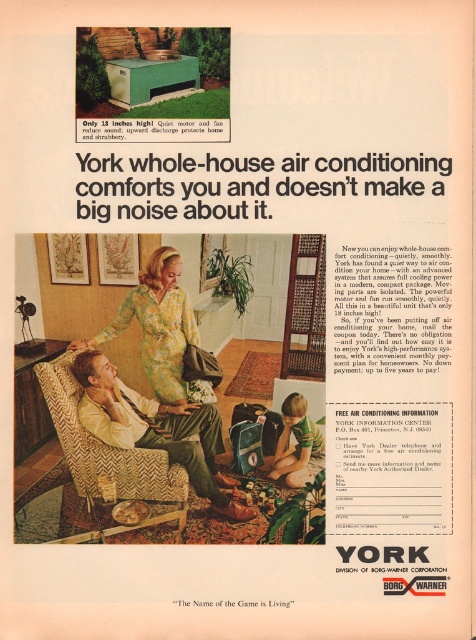
You are a interior designer planning to place a floor lamp next to the herringbone fabric chair at lower left and the green floral dress at center. Which object should the lamp be placed closer to in order to provide adequate lighting for the dress?

The lamp should be placed closer to the herringbone fabric chair at lower left because it is taller than the green floral dress at center, so positioning the lamp near the chair will ensure the dress receives sufficient light without casting shadows.

You are standing in the living room and want to move from the point at coordinates point (100,483) to the point at coordinates point (112,337). Which direction should you move to get closer to the outdoor unit shown in the top section?

Since point (100,483) is closer to the viewer than point (112,337), moving towards the point at (112,337) would take you away from the outdoor unit. To move closer to the outdoor unit, you should move away from the point at (112,337) and towards the direction where the outdoor unit is located, which is likely in the backyard area shown in the top section.